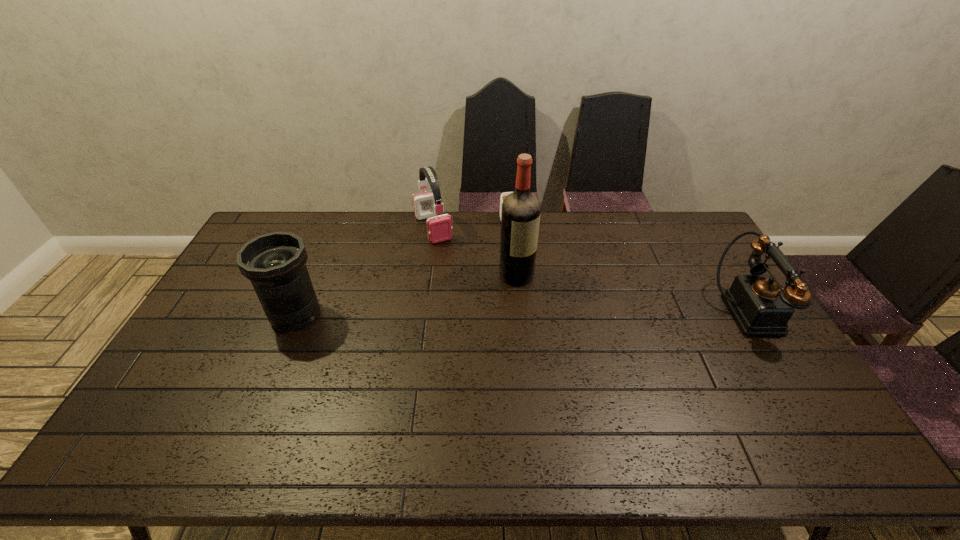
Locate an element on the screen. The image size is (960, 540). free region at the right edge of the desktop is located at coordinates (676, 250).

The width and height of the screenshot is (960, 540). I want to click on vacant space that is in between the earphone and the rightmost object, so click(x=589, y=270).

I want to click on empty space between the second object from left to right and the telephoto lens, so click(364, 271).

You are a GUI agent. You are given a task and a screenshot of the screen. Output one action in this format:
    pyautogui.click(x=<x>, y=<y>)
    Task: Click on the free spot between the liquor and the telephone
    The height and width of the screenshot is (540, 960).
    Given the screenshot: What is the action you would take?
    pyautogui.click(x=631, y=293)

At what (x,y) coordinates should I click in order to perform the action: click on vacant area that lies between the second object from left to right and the telephone. Please return your answer as a coordinate pair (x, y). Image resolution: width=960 pixels, height=540 pixels. Looking at the image, I should click on (589, 270).

Find the location of a particular element. free space between the leftmost object and the second object from left to right is located at coordinates (364, 271).

Identify the location of free area in between the earphone and the cup. coord(473,226).

You are a GUI agent. You are given a task and a screenshot of the screen. Output one action in this format:
    pyautogui.click(x=<x>, y=<y>)
    Task: Click on the unoccupied position between the rightmost object and the tallest object
    
    Given the screenshot: What is the action you would take?
    [631, 293]

At what (x,y) coordinates should I click in order to perform the action: click on blank region between the cup and the telephone. Please return your answer as a coordinate pair (x, y). Looking at the image, I should click on (629, 268).

Find the location of a particular element. free space between the tallest object and the telephoto lens is located at coordinates (406, 294).